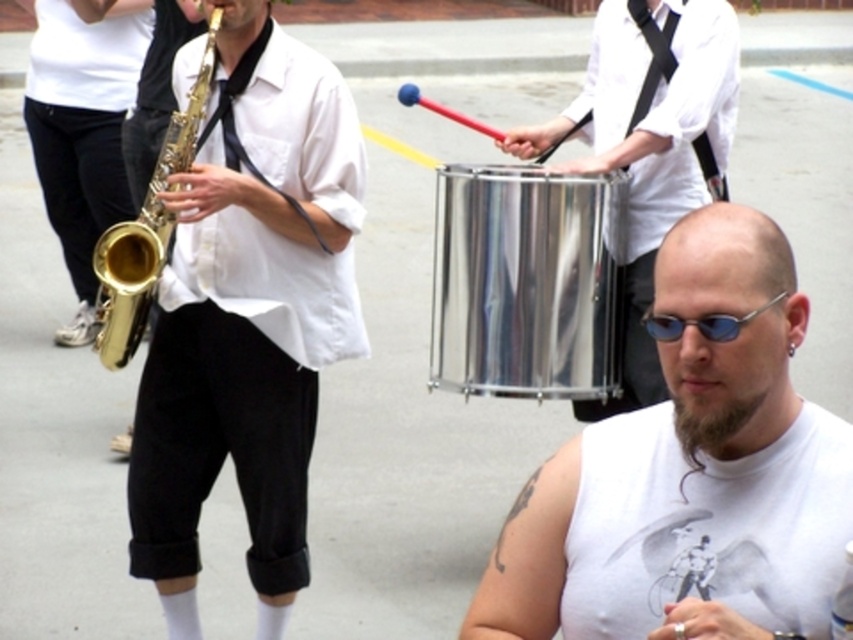
Based on the photo, is gold shiny trumpet at left to the left of blue reflective glasses at center from the viewer's perspective?

Indeed, gold shiny trumpet at left is positioned on the left side of blue reflective glasses at center.

Is gold shiny trumpet at left smaller than blue reflective glasses at center?

Incorrect, gold shiny trumpet at left is not smaller in size than blue reflective glasses at center.

The width and height of the screenshot is (853, 640). Describe the element at coordinates (146, 230) in the screenshot. I see `gold shiny trumpet at left` at that location.

Where is `gold shiny trumpet at left`? Image resolution: width=853 pixels, height=640 pixels. gold shiny trumpet at left is located at coordinates (146, 230).

In the scene shown: Is silver metallic drum at center above gold shiny trumpet at left?

Actually, silver metallic drum at center is below gold shiny trumpet at left.

Is point (602, 388) closer to viewer compared to point (135, 291)?

No, it is behind (135, 291).

Which is behind, point (460, 221) or point (163, 237)?

The point (460, 221) is behind.

What are the coordinates of `silver metallic drum at center` in the screenshot? It's located at (525, 282).

Is point (654, 397) farther from camera compared to point (669, 328)?

Yes, it is.

Between point (704, 22) and point (680, 323), which one is positioned behind?

Point (704, 22)

Image resolution: width=853 pixels, height=640 pixels. What are the coordinates of `shiny metallic drum at center` in the screenshot? It's located at (648, 145).